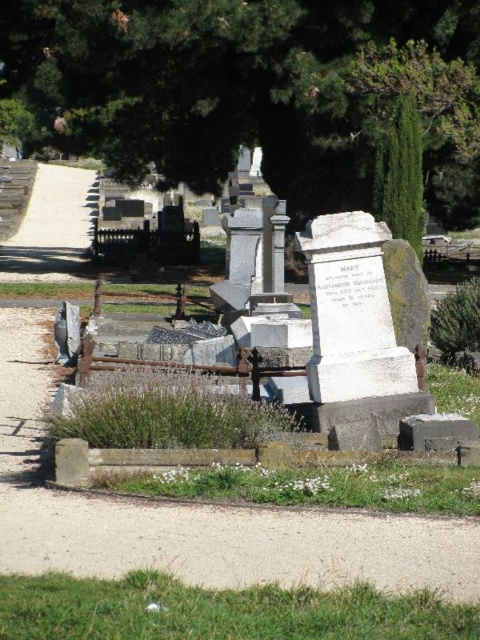
Question: Which of the following is the closest to the observer?

Choices:
 (A) (267, 211)
 (B) (141, 92)

Answer: (A)

Question: Is green leafy tree at upper center further to camera compared to white marble monument at center?

Choices:
 (A) yes
 (B) no

Answer: (A)

Question: In this image, where is green leafy tree at upper center located relative to white marble monument at center?

Choices:
 (A) left
 (B) right

Answer: (B)

Question: Can you confirm if green leafy tree at upper center is positioned above white marble monument at center?

Choices:
 (A) no
 (B) yes

Answer: (B)

Question: Among these points, which one is nearest to the camera?

Choices:
 (A) (233, 211)
 (B) (106, 160)

Answer: (B)